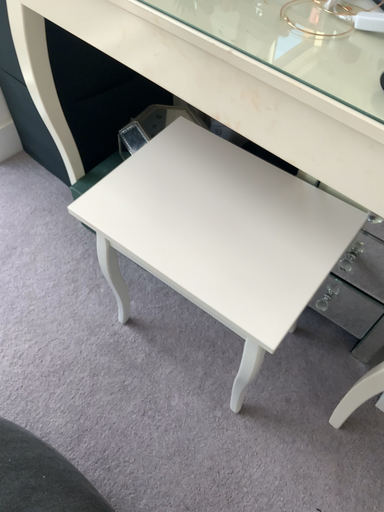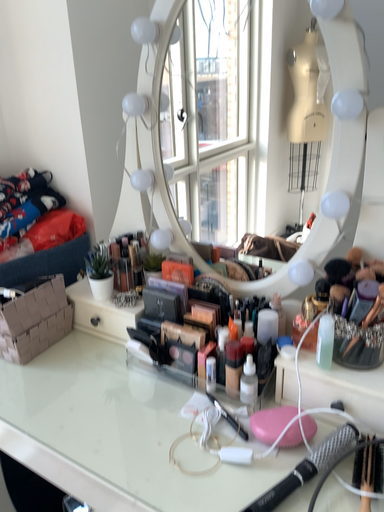
Question: Which way did the camera rotate in the video?

Choices:
 (A) rotated upward
 (B) rotated downward

Answer: (A)